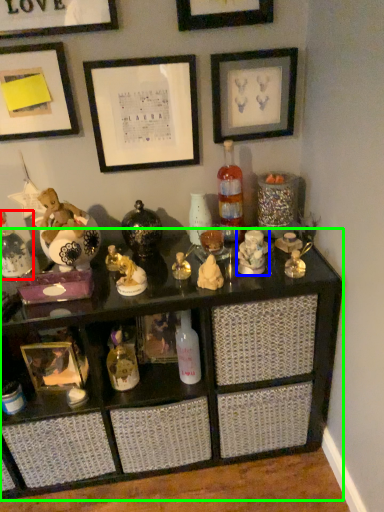
Question: Which object is positioned closest to bottle (highlighted by a red box)? Select from toy (highlighted by a blue box) and shelf (highlighted by a green box).

Choices:
 (A) toy
 (B) shelf

Answer: (B)